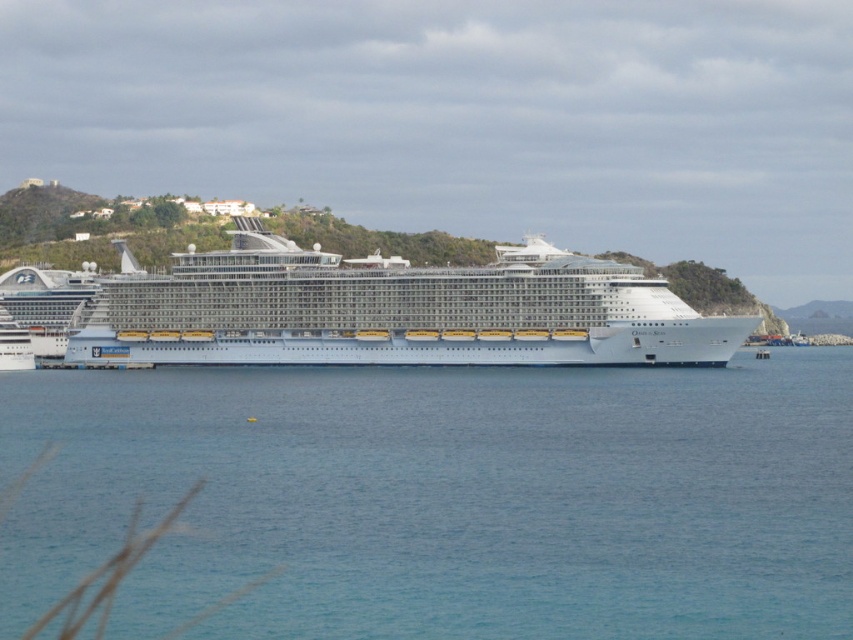
Question: Is blue water at center wider than white metallic cruise ship at center?

Choices:
 (A) yes
 (B) no

Answer: (A)

Question: Which of the following is the closest to the observer?

Choices:
 (A) white metallic cruise ship at center
 (B) blue water at center

Answer: (B)

Question: Is blue water at center below white metallic cruise ship at center?

Choices:
 (A) no
 (B) yes

Answer: (B)

Question: Which of the following is the closest to the observer?

Choices:
 (A) white metallic cruise ship at center
 (B) blue water at center

Answer: (B)

Question: Does blue water at center have a larger size compared to white metallic cruise ship at center?

Choices:
 (A) yes
 (B) no

Answer: (B)

Question: Which object is closer to the camera taking this photo?

Choices:
 (A) blue water at center
 (B) white metallic cruise ship at center

Answer: (A)